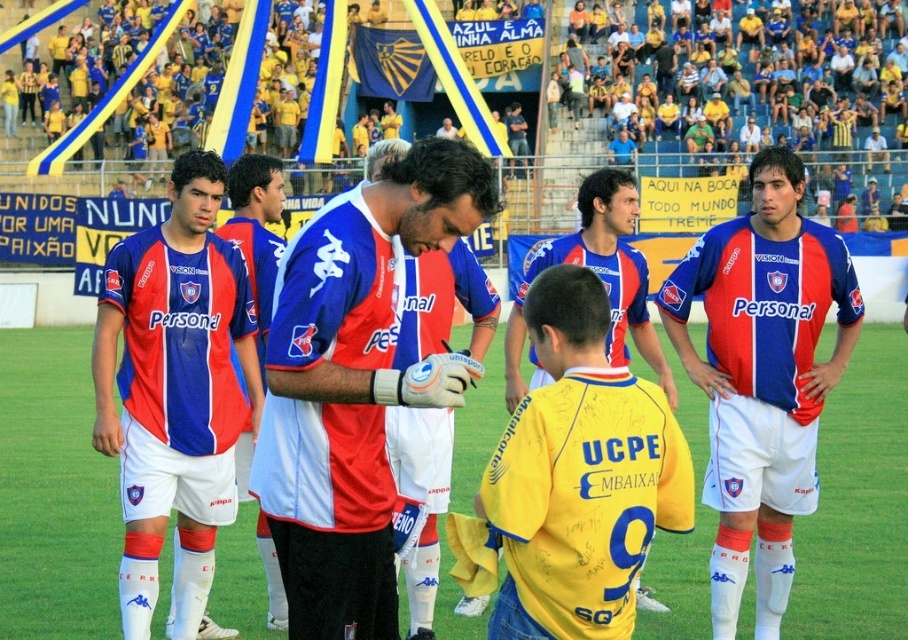
Where is `matte blue and red jersey at center`? The height and width of the screenshot is (640, 908). matte blue and red jersey at center is located at coordinates (337, 358).

Who is positioned more to the right, matte blue and red jersey at center or yellow jersey at center?

Positioned to the right is yellow jersey at center.

Between point (358, 632) and point (524, 440), which one is positioned in front?

Point (524, 440)

Find the location of a particular element. The height and width of the screenshot is (640, 908). matte blue and red jersey at center is located at coordinates pos(337,358).

Looking at this image, which is below, matte blue and red jersey at center or matte blue jersey at right?

matte blue jersey at right is lower down.

Is matte blue and red jersey at center to the right of matte blue jersey at right from the viewer's perspective?

No, matte blue and red jersey at center is not to the right of matte blue jersey at right.

Is point (466, 179) less distant than point (729, 385)?

Yes, point (466, 179) is closer to viewer.

Locate an element on the screen. matte blue and red jersey at center is located at coordinates (337, 358).

Is matte blue and red jersey at center taller than blue and red jersey at center?

Indeed, matte blue and red jersey at center has a greater height compared to blue and red jersey at center.

Is point (301, 372) closer to viewer compared to point (526, 285)?

Yes.

Identify the location of matte blue and red jersey at center. (337, 358).